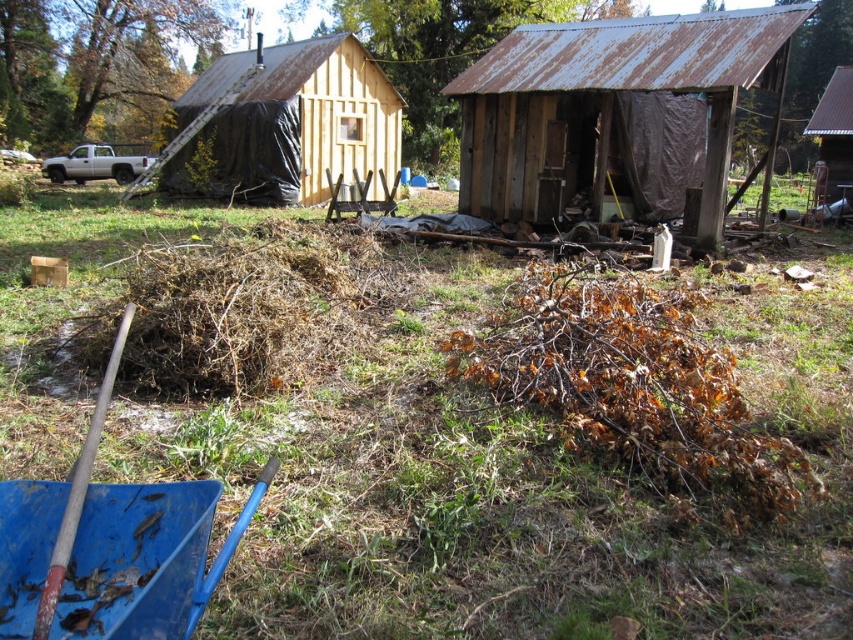
You are standing at the origin point of the coordinate system in the image. Where is the rusty metal hut at center located in terms of coordinates?

The rusty metal hut at center is located at coordinates (608, 104).